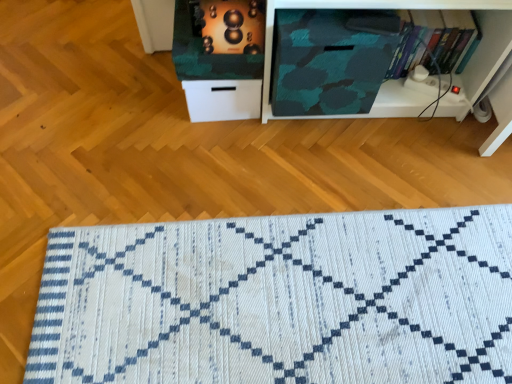
Question: From a real-world perspective, is camouflage fabric at center on metallic gold speaker at upper center?

Choices:
 (A) no
 (B) yes

Answer: (A)

Question: Is camouflage fabric at center looking in the opposite direction of metallic gold speaker at upper center?

Choices:
 (A) no
 (B) yes

Answer: (A)

Question: Is the depth of camouflage fabric at center less than that of metallic gold speaker at upper center?

Choices:
 (A) yes
 (B) no

Answer: (B)

Question: Is camouflage fabric at center outside metallic gold speaker at upper center?

Choices:
 (A) yes
 (B) no

Answer: (A)

Question: Is the surface of camouflage fabric at center in direct contact with metallic gold speaker at upper center?

Choices:
 (A) yes
 (B) no

Answer: (B)

Question: Considering the relative positions of camouflage fabric at center and metallic gold speaker at upper center in the image provided, is camouflage fabric at center to the right of metallic gold speaker at upper center from the viewer's perspective?

Choices:
 (A) yes
 (B) no

Answer: (A)

Question: Would you say hardcover book at upper right is a long distance from camouflage fabric at center?

Choices:
 (A) yes
 (B) no

Answer: (B)

Question: Considering the relative positions of hardcover book at upper right and camouflage fabric at center in the image provided, is hardcover book at upper right to the right of camouflage fabric at center from the viewer's perspective?

Choices:
 (A) no
 (B) yes

Answer: (B)

Question: Does hardcover book at upper right have a larger size compared to camouflage fabric at center?

Choices:
 (A) yes
 (B) no

Answer: (B)

Question: From a real-world perspective, is hardcover book at upper right on top of camouflage fabric at center?

Choices:
 (A) yes
 (B) no

Answer: (B)

Question: Does hardcover book at upper right have a smaller size compared to camouflage fabric at center?

Choices:
 (A) yes
 (B) no

Answer: (A)

Question: Is hardcover book at upper right further to camera compared to camouflage fabric at center?

Choices:
 (A) no
 (B) yes

Answer: (B)

Question: Does hardcover book at upper right have a smaller size compared to white woven mat at lower center?

Choices:
 (A) no
 (B) yes

Answer: (B)